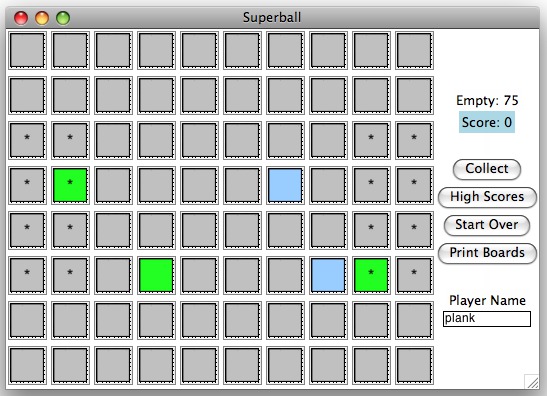
At what (x,y) coordinates should I click in order to perform the action: click on green circular 'light'. Please return your answer as a coordinate pair (x, y). Looking at the image, I should click on (59, 18).